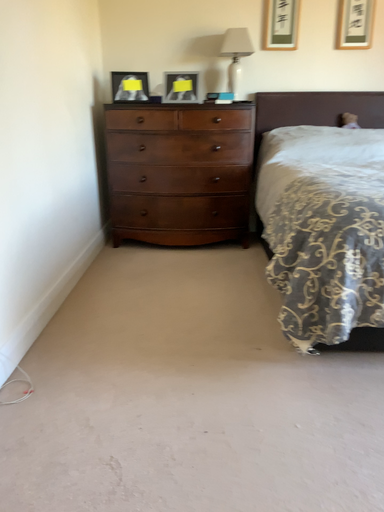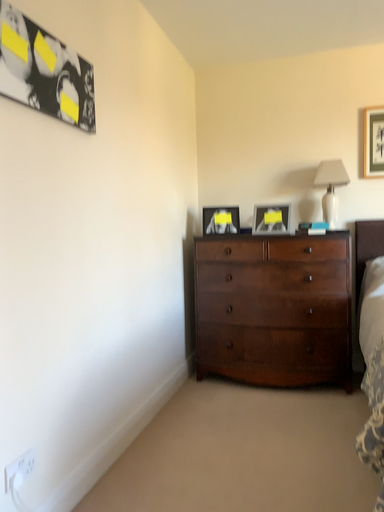
Question: Which way did the camera rotate in the video?

Choices:
 (A) rotated right
 (B) rotated left

Answer: (B)